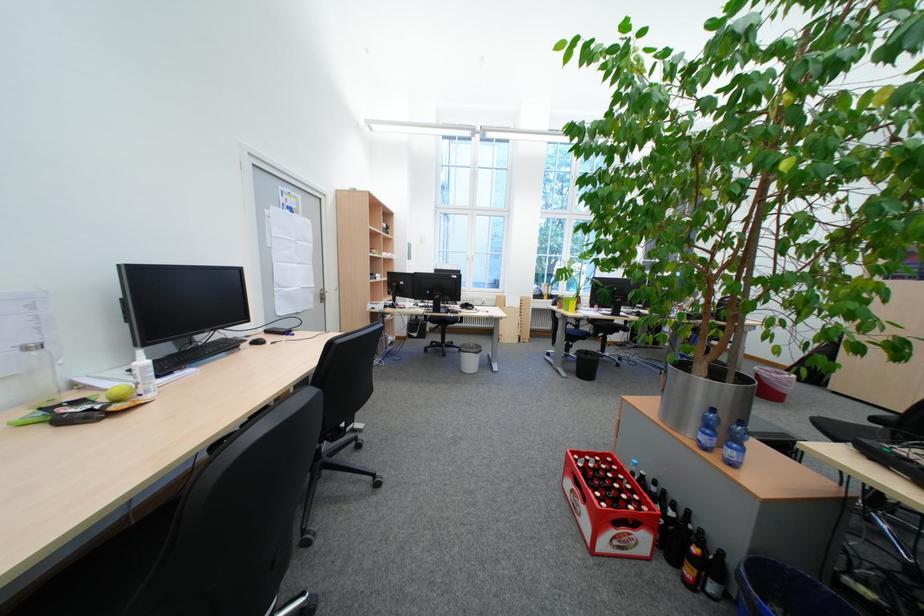
At what (x,y) coordinates should I click in order to perform the action: click on black chair sitting surface. Please return your answer as a coordinate pair (x, y). Image resolution: width=924 pixels, height=616 pixels. Looking at the image, I should click on (103, 572).